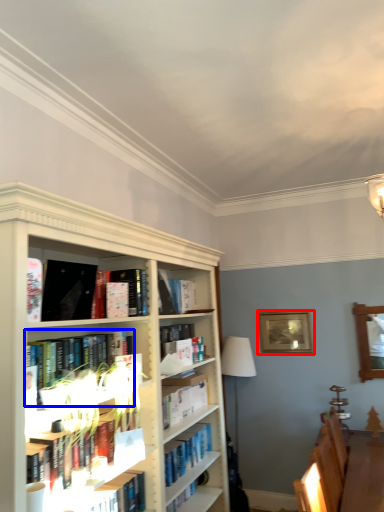
Question: Among these objects, which one is nearest to the camera, picture frame (highlighted by a red box) or book (highlighted by a blue box)?

Choices:
 (A) picture frame
 (B) book

Answer: (B)